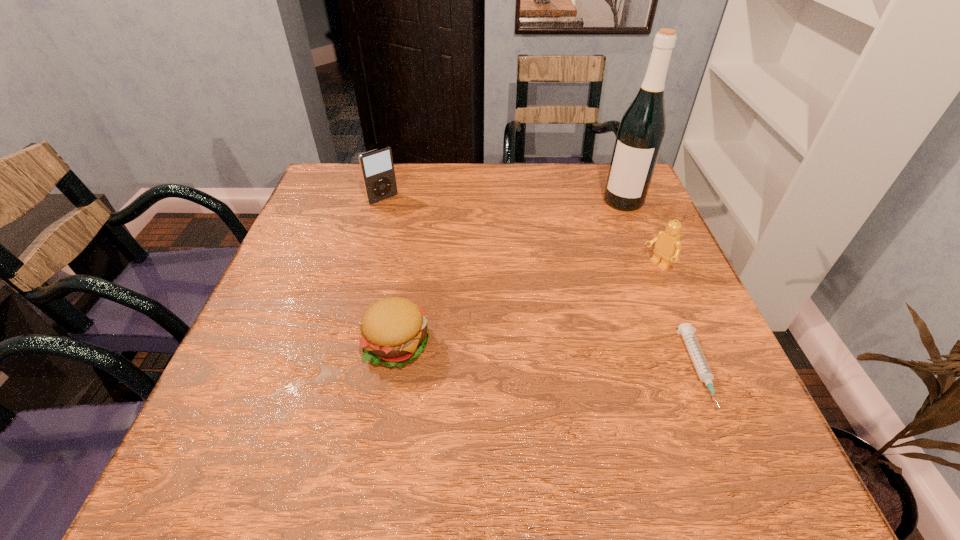
The height and width of the screenshot is (540, 960). What are the coordinates of `syringe present at the right edge` in the screenshot? It's located at (686, 330).

This screenshot has height=540, width=960. I want to click on Lego that is at the right edge, so click(x=668, y=245).

This screenshot has height=540, width=960. I want to click on wine bottle situated at the right edge, so click(x=640, y=135).

Locate an element on the screen. object located in the far left corner section of the desktop is located at coordinates (377, 168).

Where is `object situated at the far right corner`? object situated at the far right corner is located at coordinates (640, 135).

Identify the location of object at the near right corner. Image resolution: width=960 pixels, height=540 pixels. (686, 330).

At what (x,y) coordinates should I click in order to perform the action: click on vacant region at the far edge of the desktop. Please return your answer as a coordinate pair (x, y). Looking at the image, I should click on (429, 193).

This screenshot has height=540, width=960. In the image, there is a desktop. Find the location of `vacant space at the left edge`. vacant space at the left edge is located at coordinates (279, 284).

Where is `free space at the right edge of the desktop`? This screenshot has width=960, height=540. free space at the right edge of the desktop is located at coordinates (598, 220).

The height and width of the screenshot is (540, 960). Find the location of `free space at the far left corner of the desktop`. free space at the far left corner of the desktop is located at coordinates (347, 211).